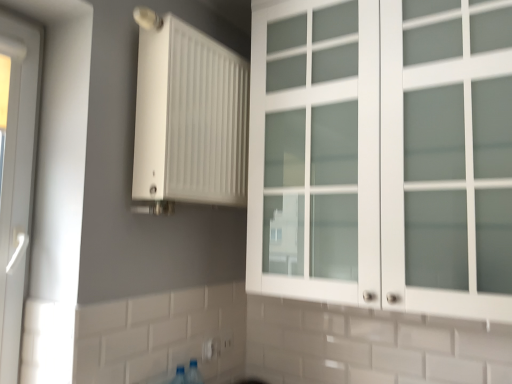
Question: Is white plastic door at left bigger than white plastic electric outlet at lower center, arranged as the 1th electric outlet when viewed from the left?

Choices:
 (A) yes
 (B) no

Answer: (A)

Question: From the image's perspective, is white plastic door at left below white plastic electric outlet at lower center, acting as the 2th electric outlet starting from the right?

Choices:
 (A) yes
 (B) no

Answer: (B)

Question: Is white plastic door at left next to white plastic electric outlet at lower center, acting as the 2th electric outlet starting from the right, and touching it?

Choices:
 (A) no
 (B) yes

Answer: (A)

Question: Considering the relative sizes of white plastic door at left and white plastic electric outlet at lower center, acting as the 2th electric outlet starting from the right, in the image provided, is white plastic door at left thinner than white plastic electric outlet at lower center, acting as the 2th electric outlet starting from the right,?

Choices:
 (A) no
 (B) yes

Answer: (A)

Question: Is white plastic door at left shorter than white plastic electric outlet at lower center, acting as the 2th electric outlet starting from the right?

Choices:
 (A) yes
 (B) no

Answer: (B)

Question: In terms of size, does white plastic electric outlet at lower center, marked as the 1th electric outlet in a back-to-front arrangement, appear bigger or smaller than white plastic door at left?

Choices:
 (A) small
 (B) big

Answer: (A)

Question: In the image, is white plastic electric outlet at lower center, marked as the 1th electric outlet in a right-to-left arrangement, on the left side or the right side of white plastic door at left?

Choices:
 (A) left
 (B) right

Answer: (B)

Question: Is white plastic electric outlet at lower center, marked as the 1th electric outlet in a right-to-left arrangement, taller or shorter than white plastic door at left?

Choices:
 (A) short
 (B) tall

Answer: (A)

Question: Is point (220, 347) positioned closer to the camera than point (7, 369)?

Choices:
 (A) farther
 (B) closer

Answer: (A)

Question: Is white plastic electric outlet at lower center, the 2th electric outlet from the left, bigger or smaller than white plastic electric outlet at lower center, arranged as the 1th electric outlet when viewed from the left?

Choices:
 (A) small
 (B) big

Answer: (B)

Question: Considering the positions of white plastic electric outlet at lower center, marked as the 1th electric outlet in a right-to-left arrangement, and white plastic electric outlet at lower center, arranged as the 1th electric outlet when viewed from the left, in the image, is white plastic electric outlet at lower center, marked as the 1th electric outlet in a right-to-left arrangement, wider or thinner than white plastic electric outlet at lower center, arranged as the 1th electric outlet when viewed from the left,?

Choices:
 (A) thin
 (B) wide

Answer: (B)

Question: In the image, is white plastic electric outlet at lower center, marked as the 1th electric outlet in a back-to-front arrangement, positioned in front of or behind white plastic electric outlet at lower center, which appears as the 2th electric outlet when viewed from the back?

Choices:
 (A) behind
 (B) front

Answer: (A)

Question: Is white plastic electric outlet at lower center, the 2th electric outlet from the left, spatially inside white plastic electric outlet at lower center, acting as the 2th electric outlet starting from the right, or outside of it?

Choices:
 (A) outside
 (B) inside

Answer: (A)

Question: Is white plastic electric outlet at lower center, the first electric outlet in the front-to-back sequence, in front of or behind white frosted glass cabinet at upper right in the image?

Choices:
 (A) front
 (B) behind

Answer: (B)

Question: From the image's perspective, relative to white frosted glass cabinet at upper right, is white plastic electric outlet at lower center, which appears as the 2th electric outlet when viewed from the back, above or below?

Choices:
 (A) above
 (B) below

Answer: (B)